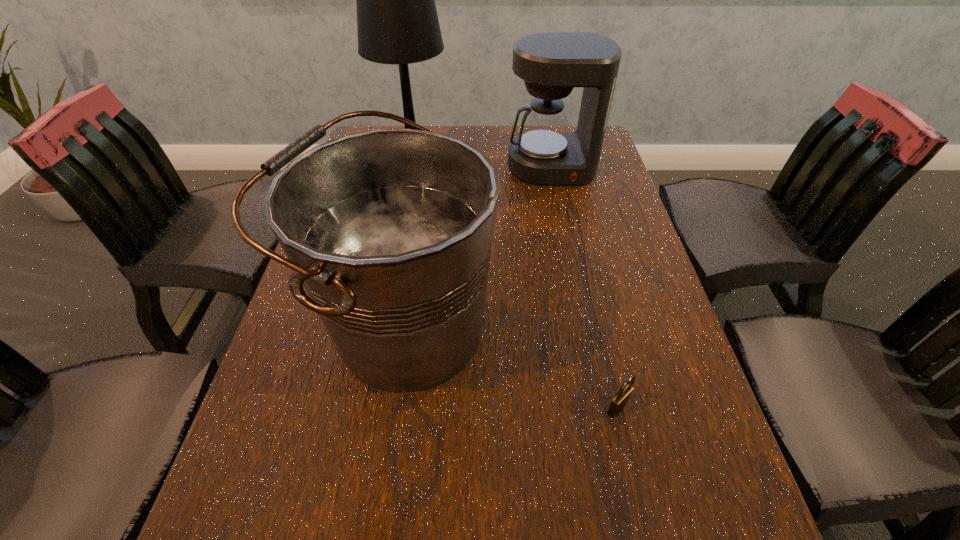
This screenshot has height=540, width=960. Find the location of `free space that is in between the padlock and the bucket`. free space that is in between the padlock and the bucket is located at coordinates (512, 367).

Locate an element on the screen. This screenshot has height=540, width=960. empty space that is in between the table lamp and the padlock is located at coordinates (516, 288).

Find the location of a particular element. The width and height of the screenshot is (960, 540). object that can be found as the third closest to the table lamp is located at coordinates (620, 400).

The width and height of the screenshot is (960, 540). What are the coordinates of `object that is the closest to the coffee maker` in the screenshot? It's located at (397, 23).

In order to click on free space that satisfies the following two spatial constraints: 1. on the front side of the bucket; 2. on the right side of the shortest object in this screenshot , I will do `click(395, 408)`.

This screenshot has width=960, height=540. What are the coordinates of `free space that satisfies the following two spatial constraints: 1. on the button side of the coffee maker; 2. on the left side of the padlock` in the screenshot? It's located at (601, 408).